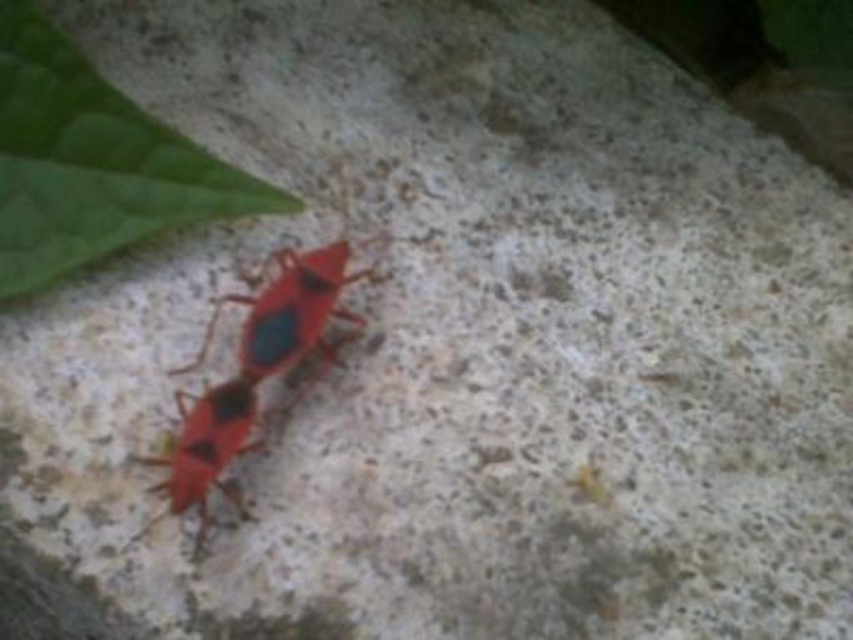
You are an artist sketching the scene and want to draw the green matte leaf at upper left and the matte red bug at center accurately. Based on their positions, which object is positioned more to the left side of the image?

The green matte leaf at upper left is positioned to the left of the matte red bug at center, so it is more to the left side of the image.